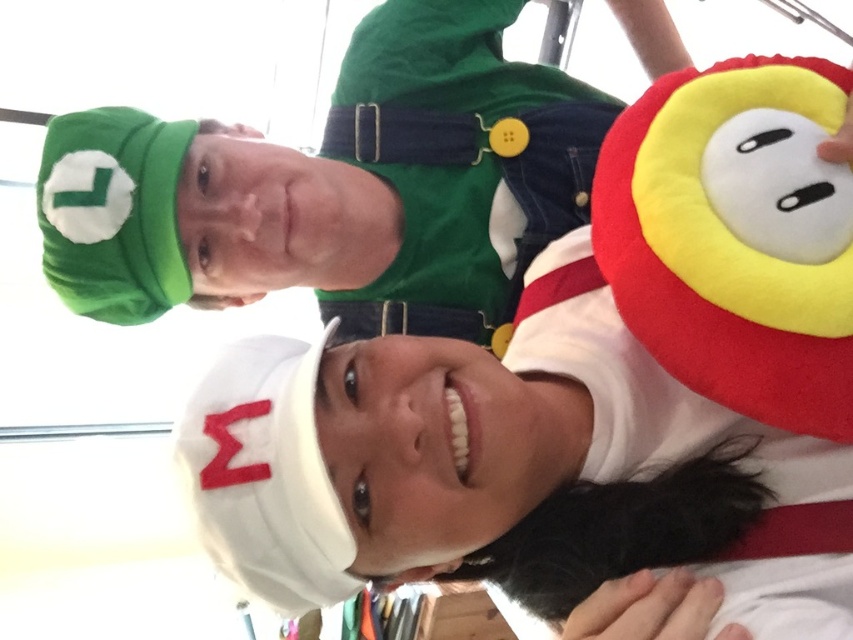
Between velvet green hat at upper left and green fabric overalls at center, which one appears on the right side from the viewer's perspective?

From the viewer's perspective, green fabric overalls at center appears more on the right side.

In the scene shown: Does velvet green hat at upper left have a lesser width compared to green fabric overalls at center?

No, velvet green hat at upper left is not thinner than green fabric overalls at center.

Who is more forward, (457, 4) or (386, 145)?

Point (386, 145) is more forward.

At what (x,y) coordinates should I click in order to perform the action: click on velvet green hat at upper left. Please return your answer as a coordinate pair (x, y). The image size is (853, 640). Looking at the image, I should click on (337, 188).

From the picture: Is velvet green hat at upper left to the right of soft plush hat at right from the viewer's perspective?

In fact, velvet green hat at upper left is to the left of soft plush hat at right.

Between velvet green hat at upper left and soft plush hat at right, which one is positioned lower?

soft plush hat at right

Where is `velvet green hat at upper left`? The image size is (853, 640). velvet green hat at upper left is located at coordinates (337, 188).

Locate an element on the screen. velvet green hat at upper left is located at coordinates (337, 188).

Looking at this image, who is positioned more to the left, green fabric overalls at center or soft plush hat at right?

green fabric overalls at center is more to the left.

The height and width of the screenshot is (640, 853). Identify the location of green fabric overalls at center. (459, 164).

Where is `green fabric overalls at center`? green fabric overalls at center is located at coordinates (459, 164).